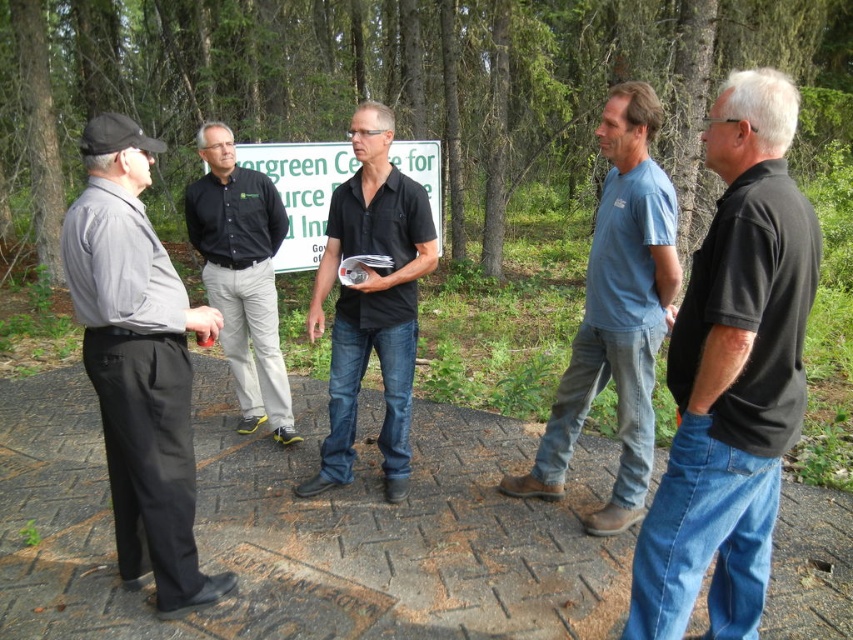
Is gray matte shirt at left smaller than blue cotton shirt at center?

Correct, gray matte shirt at left occupies less space than blue cotton shirt at center.

Measure the distance between gray matte shirt at left and camera.

gray matte shirt at left and camera are 2.40 meters apart.

Does point (138, 339) lie behind point (614, 252)?

No, it is in front of (614, 252).

Where is `gray matte shirt at left`? The width and height of the screenshot is (853, 640). gray matte shirt at left is located at coordinates (138, 364).

Who is more distant from viewer, [144,483] or [218,305]?

The point [218,305] is more distant.

Who is shorter, gray matte shirt at left or black smooth shirt at center?

Standing shorter between the two is gray matte shirt at left.

Locate an element on the screen. gray matte shirt at left is located at coordinates (138, 364).

Where is `blue cotton shirt at center`? blue cotton shirt at center is located at coordinates (618, 314).

Does point (584, 336) come farther from viewer compared to point (299, 260)?

That is False.

You are a GUI agent. You are given a task and a screenshot of the screen. Output one action in this format:
    pyautogui.click(x=<x>, y=<y>)
    Task: Click on the blue cotton shirt at center
    The image size is (853, 640).
    Given the screenshot: What is the action you would take?
    pyautogui.click(x=618, y=314)